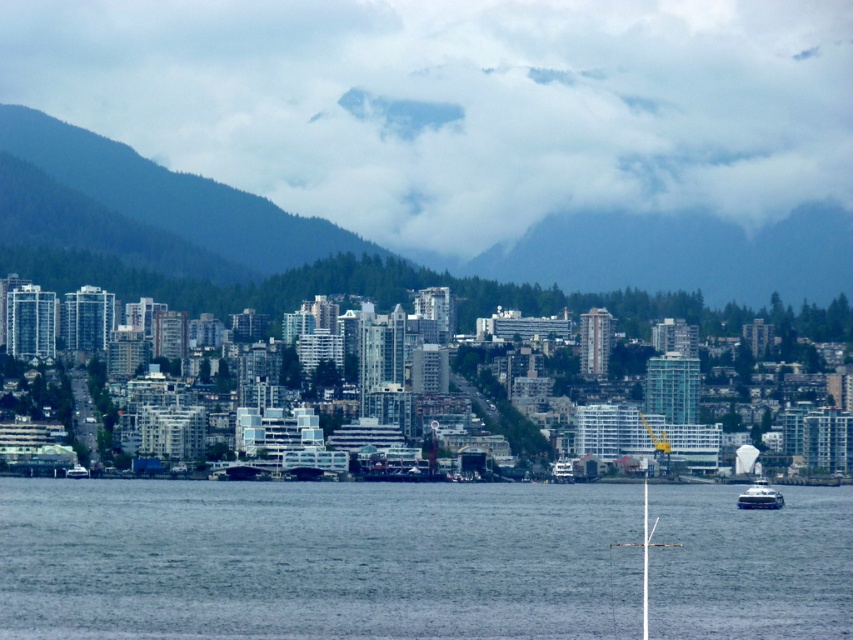
Who is positioned more to the right, green forested mountain at upper left or white glossy ferry at lower right?

white glossy ferry at lower right is more to the right.

Does green forested mountain at upper left have a larger size compared to white glossy ferry at lower right?

Yes, green forested mountain at upper left is bigger than white glossy ferry at lower right.

Is point (126, 166) positioned behind point (759, 483)?

No.

Identify the location of green forested mountain at upper left. This screenshot has height=640, width=853. (144, 208).

Is point (809, 595) farther from viewer compared to point (773, 502)?

Yes, point (809, 595) is farther from viewer.

Who is more distant from viewer, (519, 618) or (747, 486)?

The point (747, 486) is more distant.

Find the location of a particular element. This screenshot has height=640, width=853. blue water at lower center is located at coordinates tap(316, 560).

Which is below, cloudy fog at upper center or blue water at lower center?

blue water at lower center is lower down.

The height and width of the screenshot is (640, 853). In order to click on cloudy fog at upper center in this screenshot , I will do `click(459, 104)`.